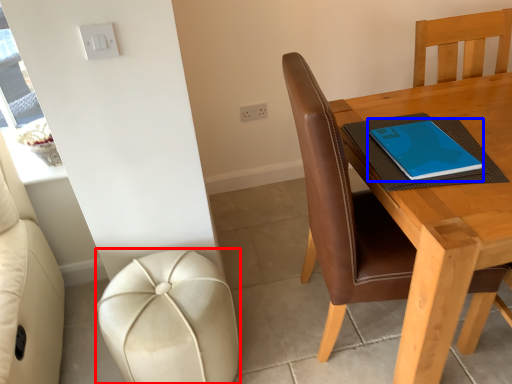
Question: Which object appears closest to the camera in this image, stool (highlighted by a red box) or notebook (highlighted by a blue box)?

Choices:
 (A) stool
 (B) notebook

Answer: (A)